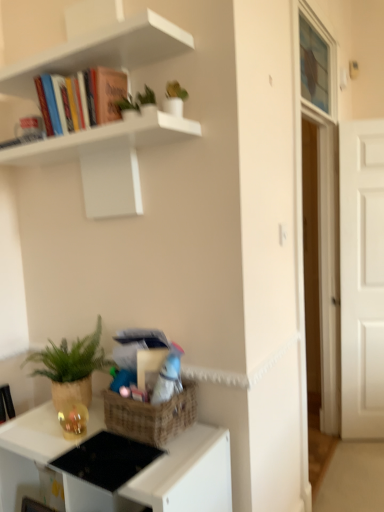
Question: From the image's perspective, does white matte shelf at upper left appear lower than white matte door at right?

Choices:
 (A) no
 (B) yes

Answer: (A)

Question: Is white matte shelf at upper left to the left of white matte door at right from the viewer's perspective?

Choices:
 (A) yes
 (B) no

Answer: (A)

Question: Can you confirm if white matte shelf at upper left is shorter than white matte door at right?

Choices:
 (A) yes
 (B) no

Answer: (A)

Question: From a real-world perspective, is white matte shelf at upper left over white matte door at right?

Choices:
 (A) yes
 (B) no

Answer: (A)

Question: Can you confirm if white matte shelf at upper left is smaller than white matte door at right?

Choices:
 (A) no
 (B) yes

Answer: (A)

Question: Can we say white matte shelf at upper left lies outside white matte door at right?

Choices:
 (A) yes
 (B) no

Answer: (A)

Question: From the image's perspective, is green woven basket at lower left above matte black desk at lower left?

Choices:
 (A) yes
 (B) no

Answer: (A)

Question: Is green woven basket at lower left facing towards matte black desk at lower left?

Choices:
 (A) yes
 (B) no

Answer: (B)

Question: Is green woven basket at lower left beside matte black desk at lower left?

Choices:
 (A) yes
 (B) no

Answer: (B)

Question: Can you confirm if green woven basket at lower left is thinner than matte black desk at lower left?

Choices:
 (A) no
 (B) yes

Answer: (B)

Question: From a real-world perspective, is green woven basket at lower left over matte black desk at lower left?

Choices:
 (A) yes
 (B) no

Answer: (A)

Question: Is green woven basket at lower left smaller than matte black desk at lower left?

Choices:
 (A) no
 (B) yes

Answer: (B)

Question: Considering the relative sizes of white matte shelf at upper left and translucent glass window screen at upper right in the image provided, is white matte shelf at upper left bigger than translucent glass window screen at upper right?

Choices:
 (A) yes
 (B) no

Answer: (A)